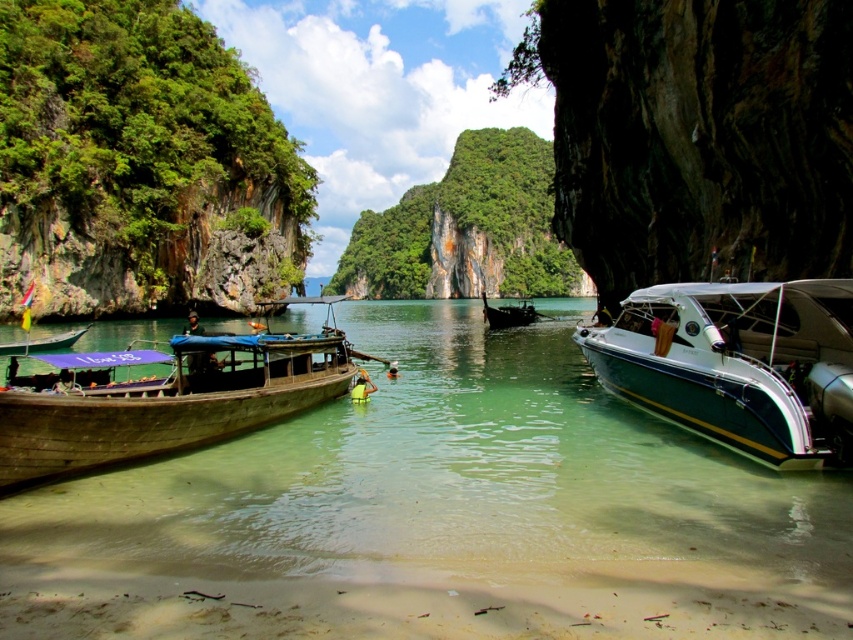
Question: Which point is closer to the camera?

Choices:
 (A) (550, 368)
 (B) (485, 301)
 (C) (752, 448)

Answer: (C)

Question: Does clear water at center come in front of wooden boat at left?

Choices:
 (A) yes
 (B) no

Answer: (A)

Question: Is white glossy motorboat at right below wooden boat at center?

Choices:
 (A) yes
 (B) no

Answer: (A)

Question: Can you confirm if wooden boat at left is bigger than wooden boat at center?

Choices:
 (A) yes
 (B) no

Answer: (B)

Question: Which object is positioned closest to the wooden boat at center?

Choices:
 (A) clear water at center
 (B) green wooden boat at left
 (C) white glossy motorboat at right

Answer: (A)

Question: Which point is farther to the camera?

Choices:
 (A) green wooden boat at left
 (B) white glossy motorboat at right
 (C) wooden boat at left

Answer: (A)